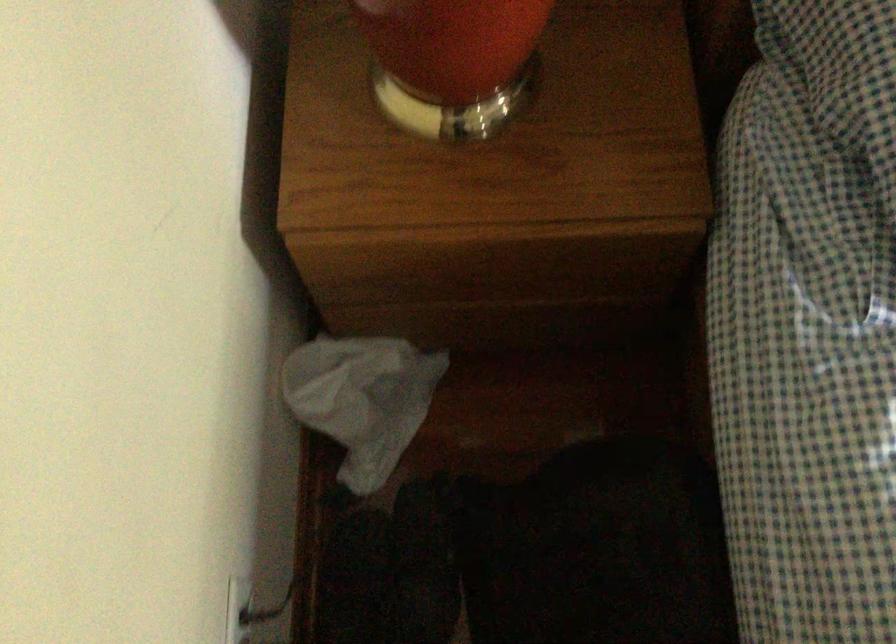
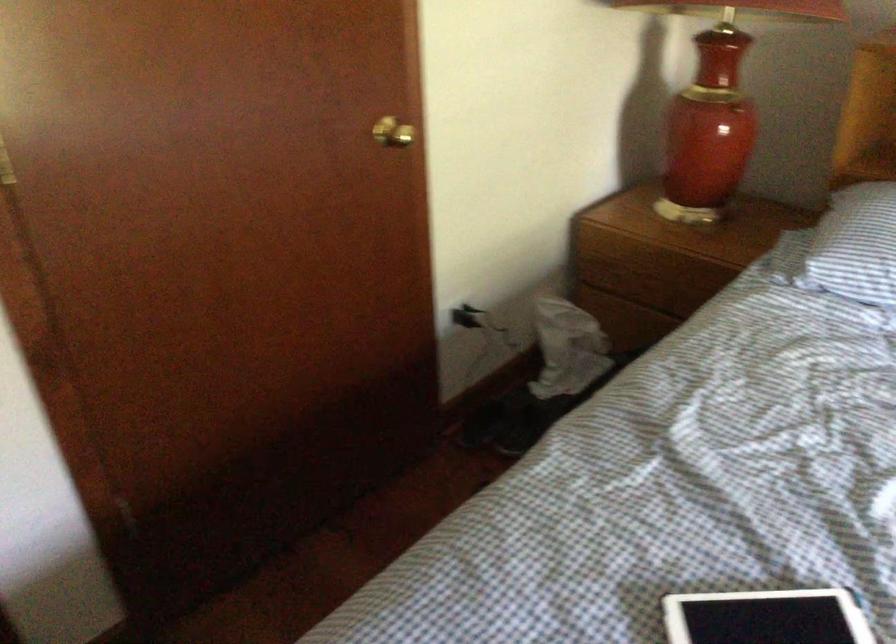
The point at (492,289) is marked in the first image. Where is the corresponding point in the second image?

(650, 283)